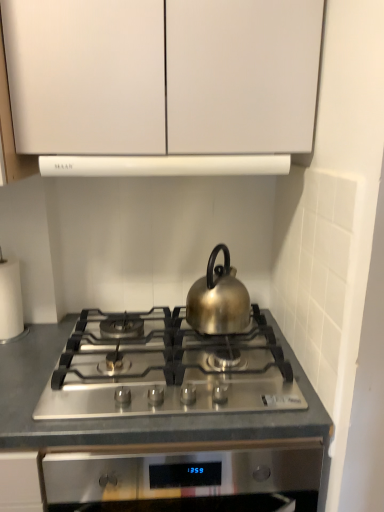
Find the location of a particular element. free location in front of white paper at left is located at coordinates (18, 358).